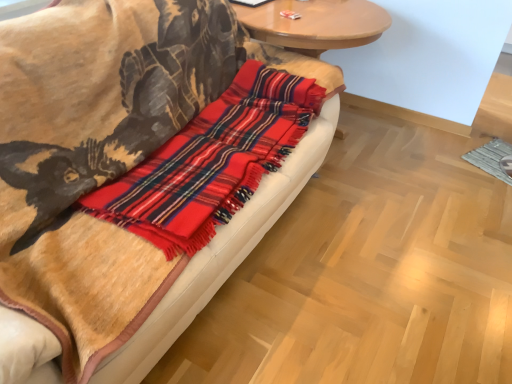
Question: Relative to red plaid flannel at center, is plaid wool blanket at center in front or behind?

Choices:
 (A) behind
 (B) front

Answer: (B)

Question: Is plaid wool blanket at center bigger or smaller than red plaid flannel at center?

Choices:
 (A) small
 (B) big

Answer: (B)

Question: Based on their relative distances, which object is nearer to the wooden round table at upper center?

Choices:
 (A) plaid wool blanket at center
 (B) red plaid flannel at center

Answer: (B)

Question: Which object is positioned farthest from the red plaid flannel at center?

Choices:
 (A) wooden round table at upper center
 (B) plaid wool blanket at center

Answer: (A)